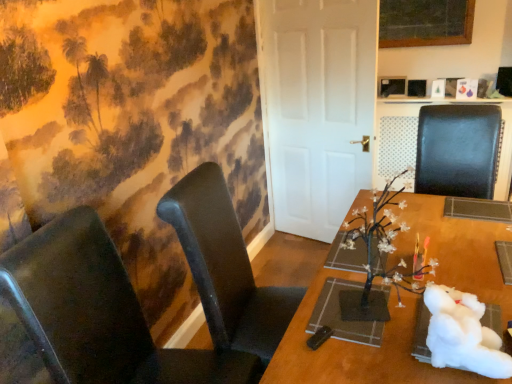
Question: Should I look upward or downward to see black leather chair at left, the second chair viewed from the left?

Choices:
 (A) up
 (B) down

Answer: (B)

Question: Is black leather chair at left, which appears as the 2th chair when viewed from the right, at the left side of black leather chair at right, the first chair positioned from the right?

Choices:
 (A) yes
 (B) no

Answer: (A)

Question: Is black leather chair at left, which appears as the 2th chair when viewed from the right, not near black leather chair at right, the first chair positioned from the right?

Choices:
 (A) no
 (B) yes

Answer: (B)

Question: Can you confirm if black leather chair at left, the second chair viewed from the left, is bigger than black leather chair at right, the first chair positioned from the right?

Choices:
 (A) yes
 (B) no

Answer: (A)

Question: Is black leather chair at left, which appears as the 2th chair when viewed from the right, not inside black leather chair at right, the first chair positioned from the right?

Choices:
 (A) yes
 (B) no

Answer: (A)

Question: Is black leather chair at left, which appears as the 2th chair when viewed from the right, placed right next to black leather chair at right, marked as the 3th chair in a left-to-right arrangement?

Choices:
 (A) yes
 (B) no

Answer: (B)

Question: Is black leather chair at left, the second chair viewed from the left, shorter than black leather chair at right, marked as the 3th chair in a left-to-right arrangement?

Choices:
 (A) no
 (B) yes

Answer: (A)

Question: Can you confirm if wooden table at center is smaller than matte black chair at left, placed as the 1th chair when sorted from left to right?

Choices:
 (A) yes
 (B) no

Answer: (B)

Question: Can you confirm if wooden table at center is wider than matte black chair at left, positioned as the 3th chair in right-to-left order?

Choices:
 (A) no
 (B) yes

Answer: (B)

Question: Can you confirm if wooden table at center is bigger than matte black chair at left, placed as the 1th chair when sorted from left to right?

Choices:
 (A) yes
 (B) no

Answer: (A)

Question: Is matte black chair at left, placed as the 1th chair when sorted from left to right, surrounded by wooden table at center?

Choices:
 (A) yes
 (B) no

Answer: (B)

Question: From the image's perspective, does wooden table at center appear higher than matte black chair at left, positioned as the 3th chair in right-to-left order?

Choices:
 (A) no
 (B) yes

Answer: (A)

Question: Is wooden table at center to the right of matte black chair at left, placed as the 1th chair when sorted from left to right, from the viewer's perspective?

Choices:
 (A) no
 (B) yes

Answer: (B)

Question: From a real-world perspective, is black leather chair at left, the second chair viewed from the left, positioned over wooden table at center based on gravity?

Choices:
 (A) yes
 (B) no

Answer: (A)